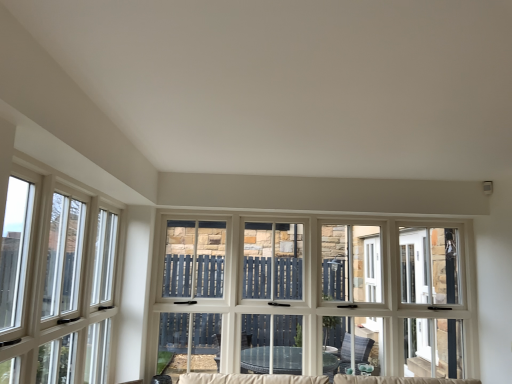
Question: From the image's perspective, is white wood window at center, which is counted as the second window, starting from the left, located above or below clear glass window at left, placed as the first window when sorted from front to back?

Choices:
 (A) below
 (B) above

Answer: (A)

Question: From a real-world perspective, relative to clear glass window at left, which is counted as the first window, starting from the left, is white wood window at center, which is counted as the second window, starting from the left, vertically above or below?

Choices:
 (A) above
 (B) below

Answer: (B)

Question: Visually, is white wood window at center, which is the 1th window from right to left, positioned to the left or to the right of clear glass window at left, which is the second window in back-to-front order?

Choices:
 (A) left
 (B) right

Answer: (B)

Question: Do you think clear glass window at left, which is counted as the first window, starting from the left, is within white wood window at center, arranged as the first window when viewed from the back, or outside of it?

Choices:
 (A) outside
 (B) inside

Answer: (A)

Question: In terms of height, does clear glass window at left, which is the second window in back-to-front order, look taller or shorter compared to white wood window at center, which is counted as the second window, starting from the left?

Choices:
 (A) tall
 (B) short

Answer: (B)

Question: From a real-world perspective, is clear glass window at left, which is the second window in back-to-front order, above or below white wood window at center, which is the 1th window from right to left?

Choices:
 (A) below
 (B) above

Answer: (B)

Question: Is point (69, 350) positioned closer to the camera than point (438, 364)?

Choices:
 (A) farther
 (B) closer

Answer: (B)